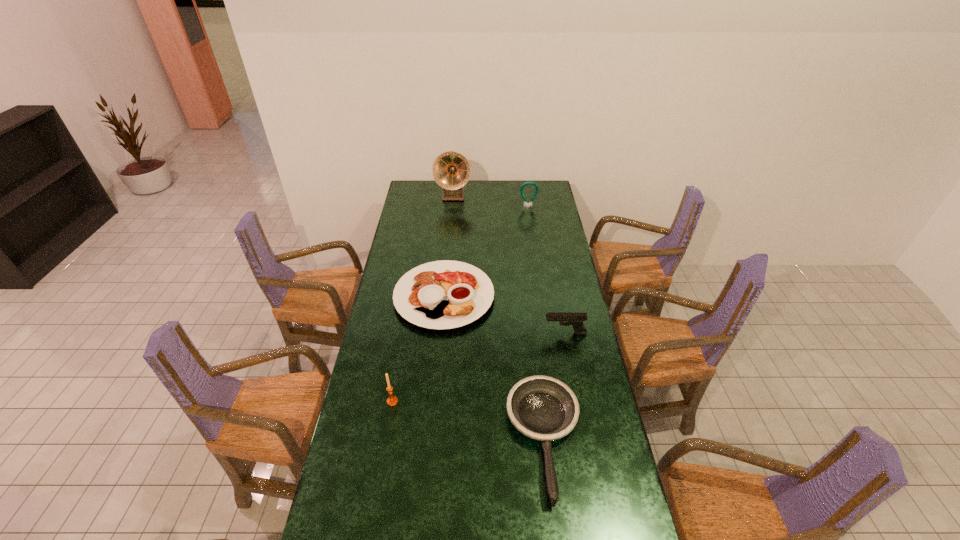
What are the coordinates of `vacant point located 0.160m on the front-facing side of the fourth tallest object` in the screenshot? It's located at (504, 333).

The image size is (960, 540). Identify the location of vacant space located on the front-facing side of the fourth tallest object. (493, 333).

This screenshot has height=540, width=960. I want to click on vacant space situated on the front-facing side of the fourth tallest object, so click(x=451, y=333).

Locate an element on the screen. free location located 0.290m on the back of the platter is located at coordinates (450, 230).

The image size is (960, 540). I want to click on object that is at the far edge, so click(x=451, y=170).

I want to click on candle_holder that is at the left edge, so click(392, 400).

Where is `platter positioned at the left edge`? platter positioned at the left edge is located at coordinates (445, 294).

Identify the location of bottle opener present at the right edge. The width and height of the screenshot is (960, 540). (529, 182).

Find the location of `pistol located at the right edge`. pistol located at the right edge is located at coordinates click(x=576, y=320).

Find the location of a particular element. The width and height of the screenshot is (960, 540). frying pan that is positioned at the right edge is located at coordinates (543, 408).